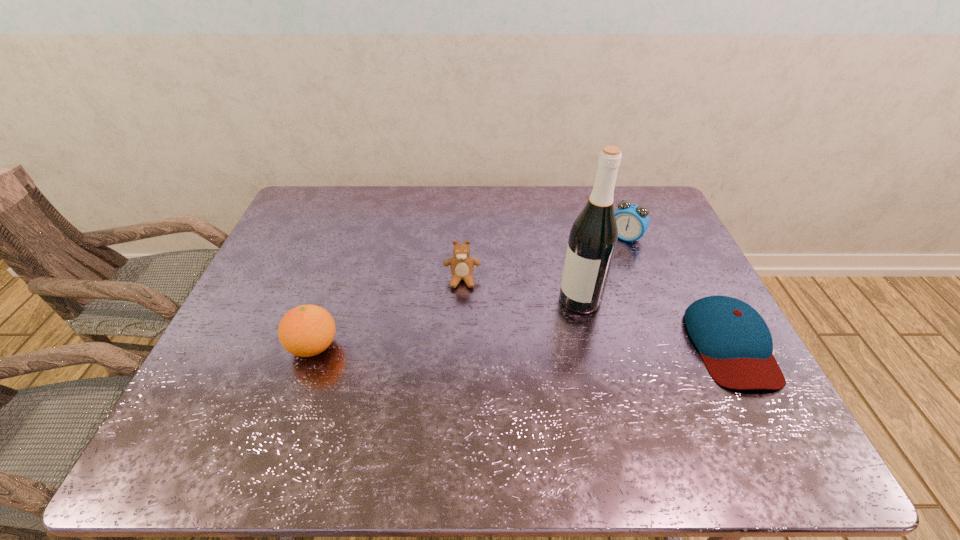
Where is `orange`? This screenshot has height=540, width=960. orange is located at coordinates pyautogui.click(x=307, y=330).

Find the location of a particular element. baseball cap is located at coordinates (735, 343).

Find the location of a particular element. the shortest object is located at coordinates (735, 343).

Locate an element on the screen. the farthest object is located at coordinates (633, 220).

Locate an element on the screen. the fourth object from left to right is located at coordinates (633, 220).

The height and width of the screenshot is (540, 960). Identify the location of the third object from left to right. (593, 238).

The height and width of the screenshot is (540, 960). I want to click on the tallest object, so tap(593, 238).

At what (x,y) coordinates should I click in order to perform the action: click on the second object from left to right. Please return your answer as a coordinate pair (x, y). Looking at the image, I should click on (461, 264).

This screenshot has height=540, width=960. In order to click on vacant point located 0.380m on the right of the leftmost object in this screenshot , I will do `click(494, 347)`.

At what (x,y) coordinates should I click in order to perform the action: click on free space located 0.170m on the face of the alarm clock. Please return your answer as a coordinate pair (x, y). Image resolution: width=960 pixels, height=540 pixels. Looking at the image, I should click on (595, 276).